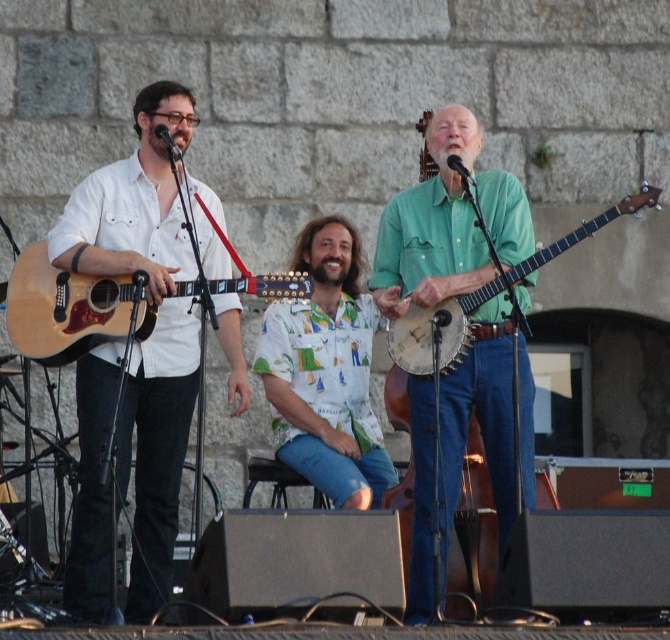
You are a photographer at this live performance. You want to capture a photo where both the hawaiian print shirt at center and the natural wood acoustic guitar at center are clearly visible. Based on their positions, which object is closer to the camera and might block the other?

The hawaiian print shirt at center is closer to the camera than the natural wood acoustic guitar at center, so it might block the guitar if not positioned carefully.

You are a photographer positioned behind the stage. You need to capture a closeup shot of the hawaiian print shirt at center and the natural wood acoustic guitar at center. Which one should you zoom in on first to ensure both are in frame?

The hawaiian print shirt at center is thinner than the natural wood acoustic guitar at center, so you should zoom in on the natural wood acoustic guitar at center first to accommodate its larger width.